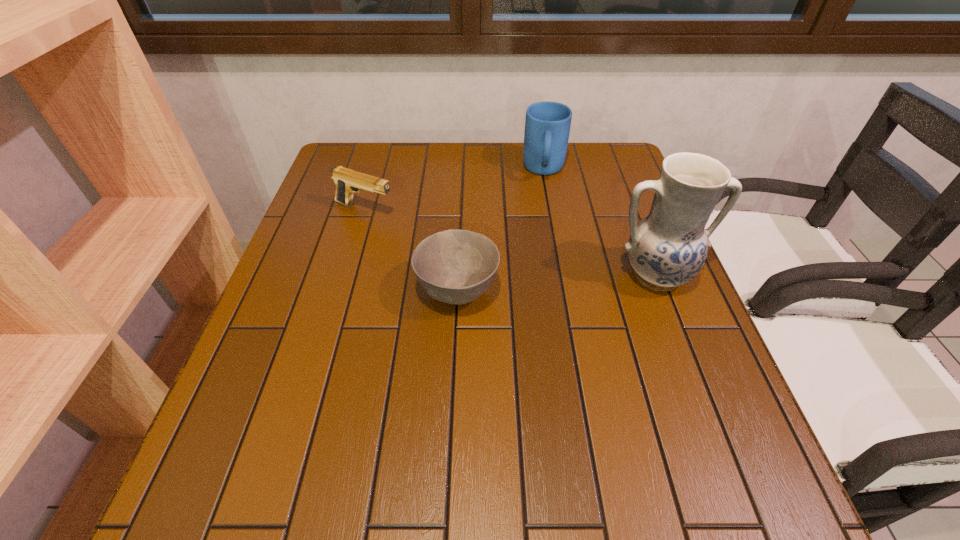
What are the coordinates of `free spot located 0.230m on the side of the second object from right to left with the handle` in the screenshot? It's located at (543, 242).

This screenshot has width=960, height=540. I want to click on free point located 0.330m on the side of the second object from right to left with the handle, so click(x=543, y=271).

Locate an element on the screen. blank space located at the barrel of the second farthest object is located at coordinates (445, 232).

Image resolution: width=960 pixels, height=540 pixels. I want to click on free space located at the barrel of the second farthest object, so [x=488, y=247].

Identify the location of free space located at the barrel of the second farthest object. This screenshot has width=960, height=540. (488, 247).

Identify the location of object that is at the far edge. (547, 125).

Find the location of a particular element. Image resolution: width=960 pixels, height=540 pixels. object located in the left edge section of the desktop is located at coordinates (347, 181).

This screenshot has height=540, width=960. I want to click on object positioned at the right edge, so click(x=668, y=247).

I want to click on free space at the far edge of the desktop, so click(x=433, y=177).

Where is `vacant space at the left edge of the desktop`? vacant space at the left edge of the desktop is located at coordinates (339, 215).